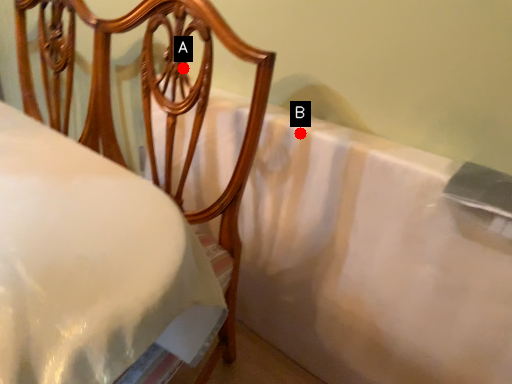
Question: Two points are circled on the image, labeled by A and B beside each circle. Which point is farther from the camera taking this photo?

Choices:
 (A) A is further
 (B) B is further

Answer: (B)